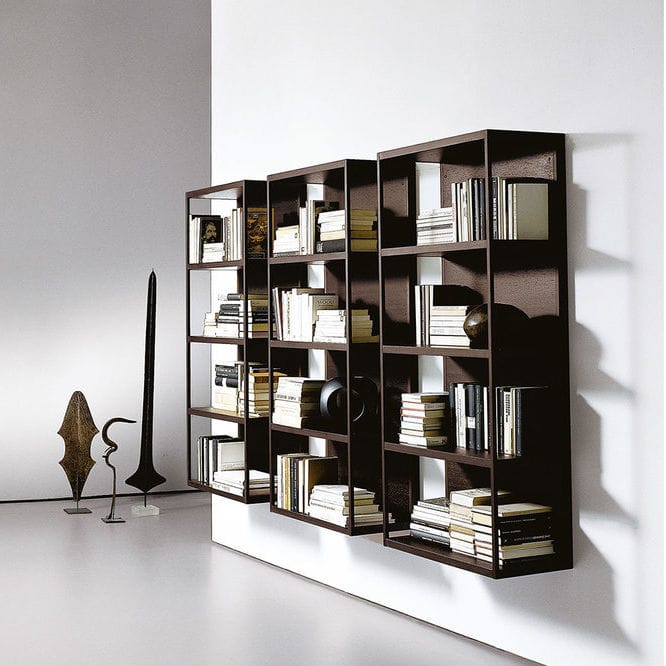
Image resolution: width=666 pixels, height=666 pixels. I want to click on books standing and laying down on bottom shelf, so click(x=200, y=466), click(x=208, y=444), click(x=218, y=456), click(x=232, y=486), click(x=236, y=476).